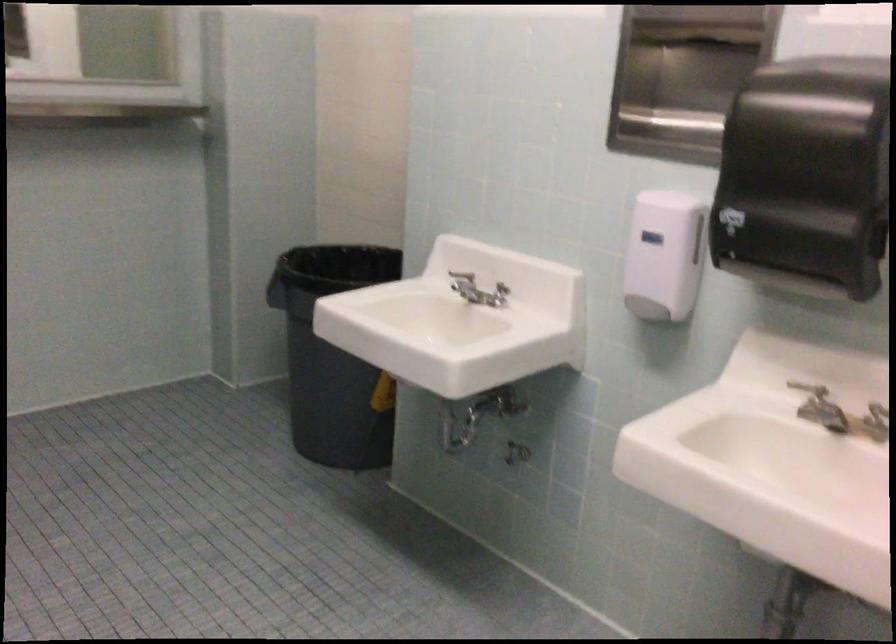
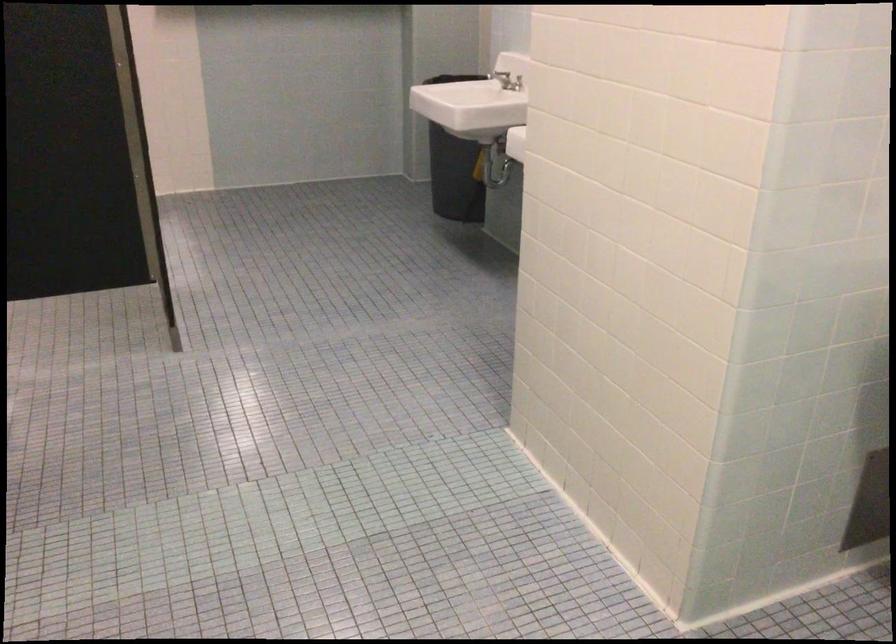
Locate, in the second image, the point that corresponds to (x=340, y=402) in the first image.

(453, 167)